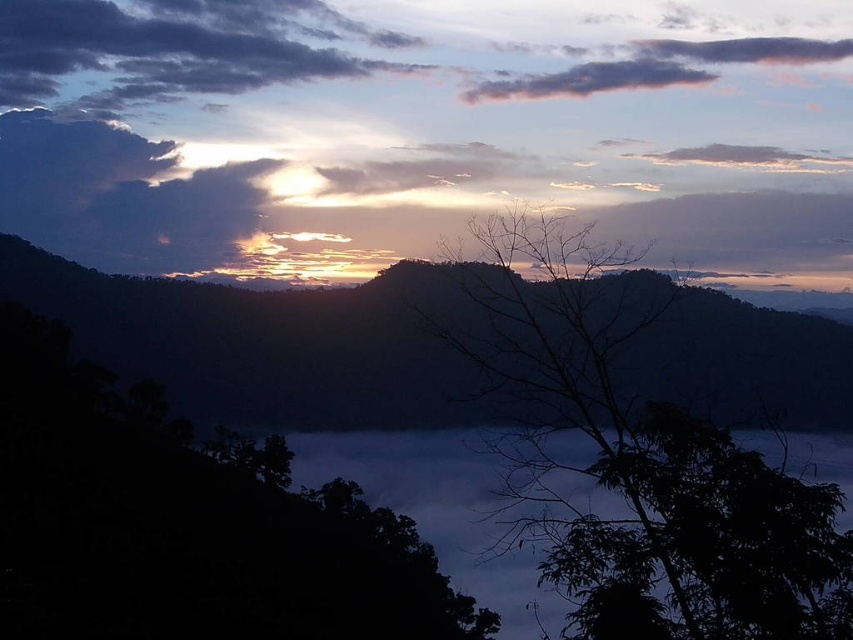
Question: Can you confirm if silhouette leafless branch at center is bigger than dark gray fluffy cloud at upper left?

Choices:
 (A) no
 (B) yes

Answer: (B)

Question: Which object appears farthest from the camera in this image?

Choices:
 (A) silhouette leafless branch at center
 (B) dark gray cloud at upper center
 (C) white mist at lower center

Answer: (B)

Question: Does silhouette leafless branch at center come in front of silhouetted mountain at center?

Choices:
 (A) no
 (B) yes

Answer: (B)

Question: In this image, where is dark gray fluffy cloud at upper left located relative to dark gray cloud at upper center?

Choices:
 (A) right
 (B) left

Answer: (B)

Question: Which point is farther to the camera?

Choices:
 (A) (775, 312)
 (B) (38, 64)
 (C) (665, 540)
 (D) (224, 52)

Answer: (B)

Question: Which point is farther to the camera?

Choices:
 (A) silhouetted mountain at center
 (B) dark gray fluffy cloud at upper left
 (C) white mist at lower center
 (D) dark gray cloud at upper center

Answer: (B)